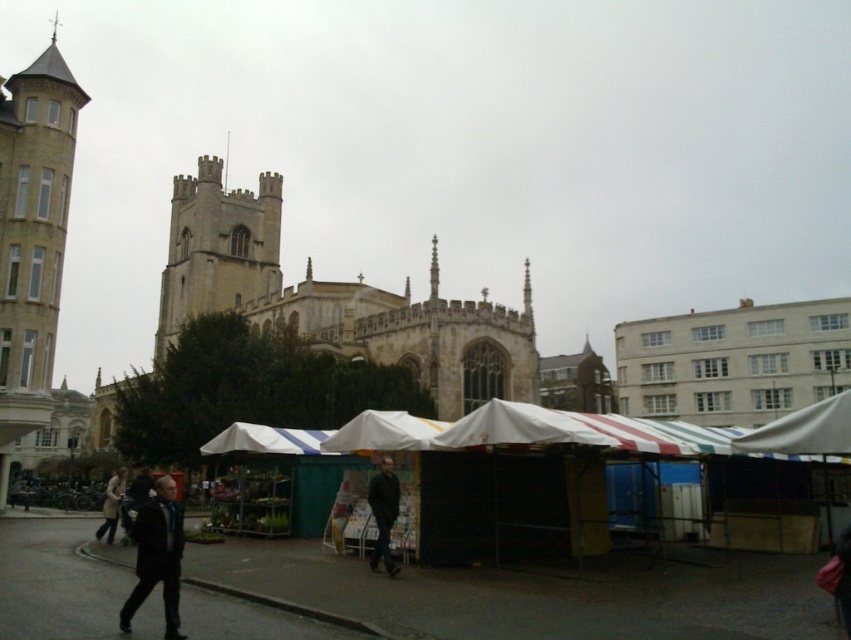
You are standing at the entrance of the market, which is at coordinate point 0.000, 0.000. The market extends to the point 1.000, 1.000. You need to find the stone gothic cathedral at center. What are the coordinates of the cathedral?

The coordinates of the stone gothic cathedral at center are at point (335, 300).